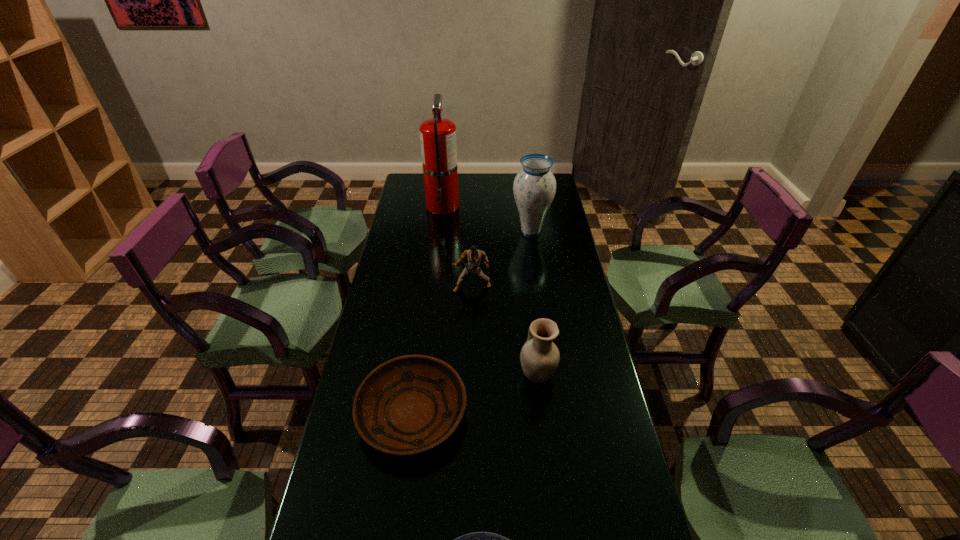
Where is `vacant area at the left edge`? vacant area at the left edge is located at coordinates (419, 251).

Locate an element on the screen. Image resolution: width=960 pixels, height=540 pixels. free point at the right edge is located at coordinates (604, 426).

Identify the location of empty space that is in between the pottery and the second shortest object. Image resolution: width=960 pixels, height=540 pixels. click(x=475, y=394).

Where is `vacant area that lies between the fourth nearest object and the fifth tallest object`? The image size is (960, 540). vacant area that lies between the fourth nearest object and the fifth tallest object is located at coordinates pyautogui.click(x=443, y=350).

The image size is (960, 540). Find the location of `free point between the fifth nearest object and the fire extinguisher`. free point between the fifth nearest object and the fire extinguisher is located at coordinates (487, 219).

The height and width of the screenshot is (540, 960). I want to click on unoccupied position between the tallest object and the third farthest object, so click(457, 247).

I want to click on free space between the second shortest object and the pottery, so click(x=475, y=394).

Identify which object is the third closest to the fifth tallest object. Please provide its 2D coordinates. Your answer should be formatted as a tuple, i.e. [(x, y)], where the tuple contains the x and y coordinates of a point satisfying the conditions above.

[(474, 256)]

The width and height of the screenshot is (960, 540). Identify the location of object that stands as the fifth closest to the nearest object. (438, 141).

The image size is (960, 540). Identify the location of blank space that satisfies the following two spatial constraints: 1. at the nozzle of the second farthest object; 2. on the right side of the farthest object. (440, 232).